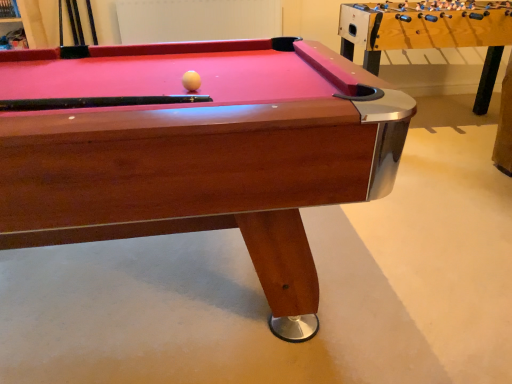
Question: In terms of height, does wooden billiard table at center look taller or shorter compared to wooden foosball table at right?

Choices:
 (A) tall
 (B) short

Answer: (B)

Question: Considering the positions of point (198, 109) and point (351, 16), is point (198, 109) closer or farther from the camera than point (351, 16)?

Choices:
 (A) farther
 (B) closer

Answer: (B)

Question: Which is farther from the wooden foosball table at right?

Choices:
 (A) wooden billiard table at center
 (B) white matte ball at center

Answer: (B)

Question: Which object is the closest to the white matte ball at center?

Choices:
 (A) wooden billiard table at center
 (B) wooden foosball table at right

Answer: (A)